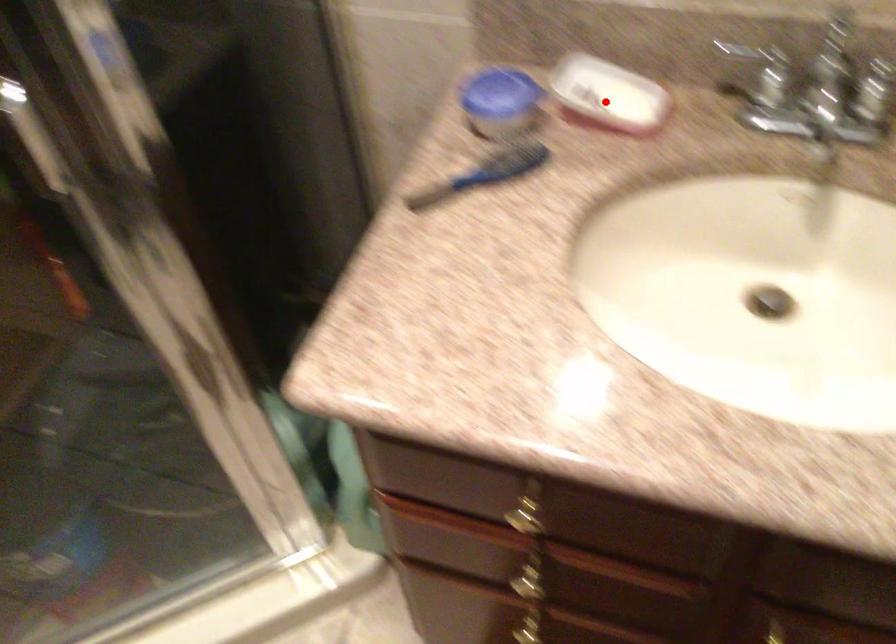
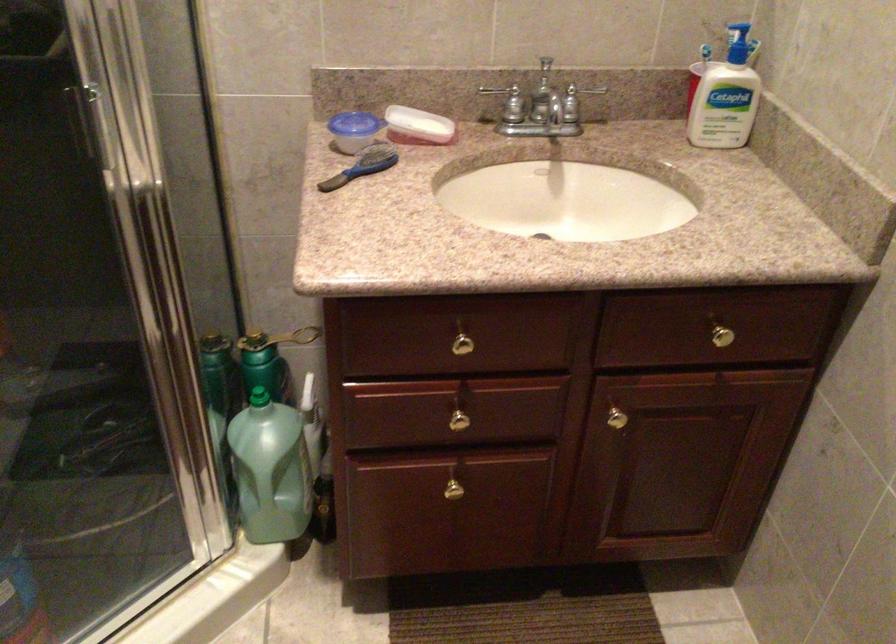
In the second image, find the point that corresponds to the highlighted location in the first image.

(418, 126)